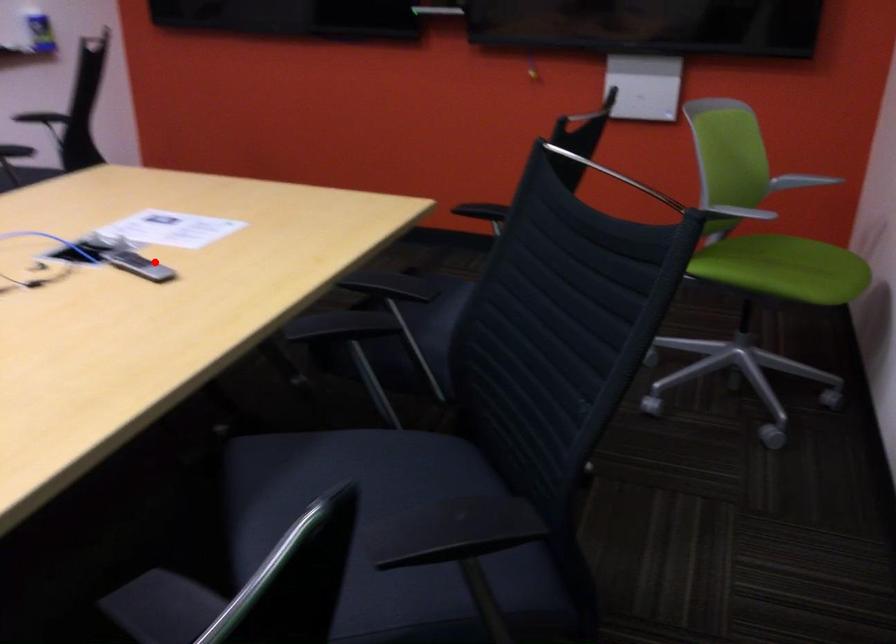
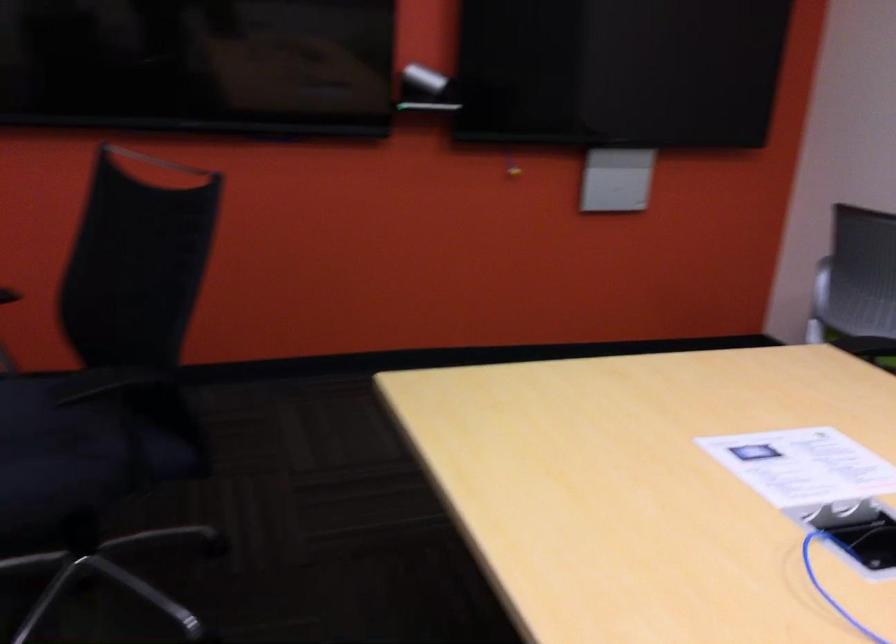
Find the pixel in the second image that matches the highlighted location in the first image.

(858, 532)